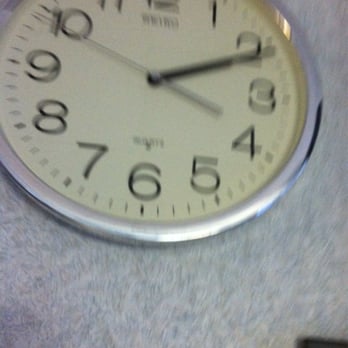
Locate an element on the screen. The width and height of the screenshot is (348, 348). blurry clock hour hand is located at coordinates (270, 51), (243, 59), (213, 63), (173, 70).